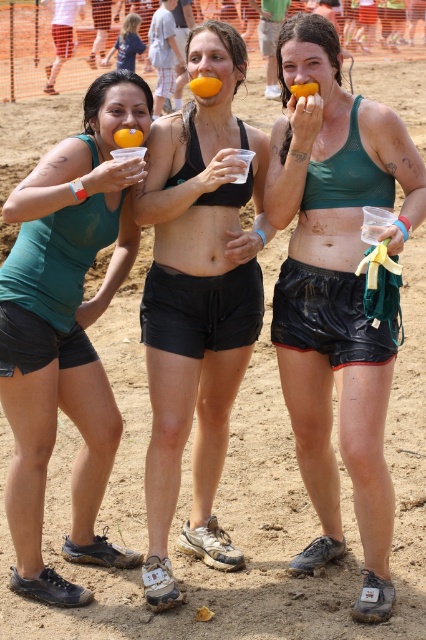
Question: Which object appears farthest from the camera in this image?

Choices:
 (A) black matte bikini top at center
 (B) orangesmoothorange at center
 (C) black fabric shorts at center

Answer: (C)

Question: Is the position of black matte shorts at lower left more distant than that of orange matte cup at center?

Choices:
 (A) yes
 (B) no

Answer: (B)

Question: Does matte green tank top at center appear on the left side of shiny black shorts at center?

Choices:
 (A) yes
 (B) no

Answer: (B)

Question: Estimate the real-world distances between objects in this image. Which object is farther from the black matte bikini top at center?

Choices:
 (A) black fabric shorts at center
 (B) black matte shorts at lower left
 (C) matte green tank top at center

Answer: (B)

Question: Which of the following is the closest to the observer?

Choices:
 (A) orangesmoothorange at center
 (B) black matte shorts at lower left
 (C) orange matte cup at center
 (D) matte green tank top at center

Answer: (D)

Question: Is the position of black matte shorts at lower left less distant than that of orangesmoothorange at center?

Choices:
 (A) yes
 (B) no

Answer: (A)